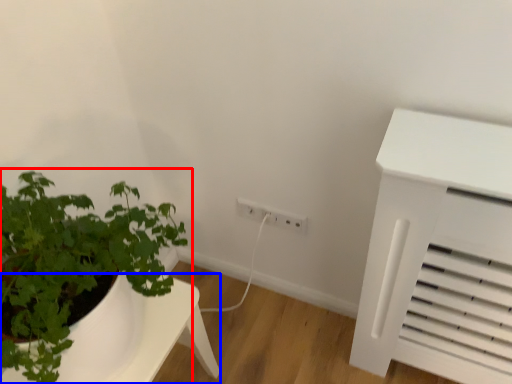
Question: Which of the following is the closest to the observer, houseplant (highlighted by a red box) or table (highlighted by a blue box)?

Choices:
 (A) houseplant
 (B) table

Answer: (A)